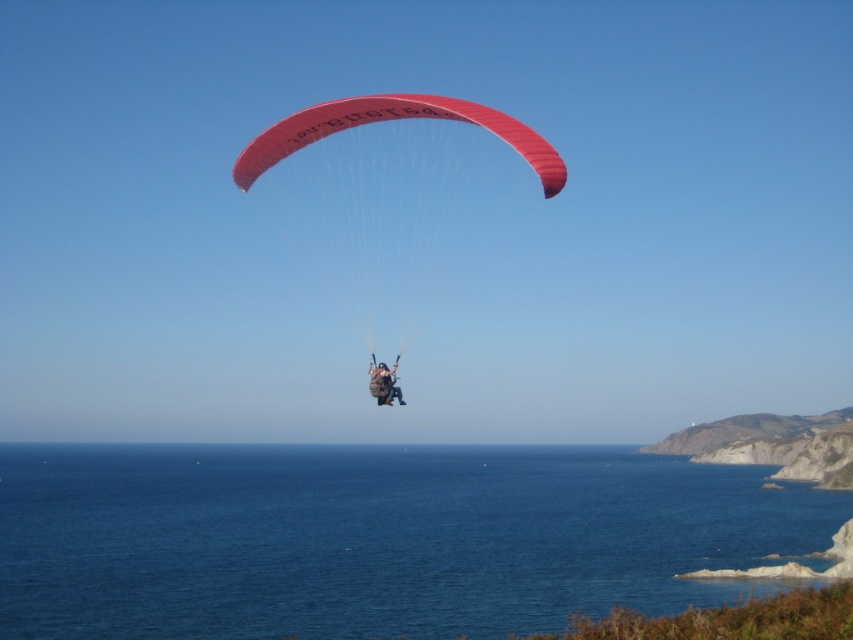
You are a paraglider pilot preparing to land in the blue liquid water at center. The safety manual states that you must descend at a rate of no more than 10 feet per second to avoid injury. If you start your descent from your current altitude, how long will it take you to reach the water safely?

The blue liquid water at center and camera are 186.85 feet apart. To descend safely at 10 feet per second, it would take 186.85 divided by 10, which equals approximately 18.685 seconds. Rounding up, you should plan for about 19 seconds to reach the water safely.

You are a photographer planning to capture the paraglider scene. You have a camera with a lens that can focus on objects up to 10 meters wide. Given that the matte red parachute at center and the camouflage fabric paraglider at center are both in your frame, can your lens accommodate both in terms of width?

The matte red parachute at center is wider than the camouflage fabric paraglider at center. Since the lens can focus on objects up to 10 meters wide, and the wider matte red parachute at center would be the determining factor, both objects can fit within the lens range if the parachute is within the 10 meters width limit. However, without knowing the exact width of the parachute, we can only confirm that the camouflage fabric paraglider at center definitely fits, but the parachute might also fit depending.